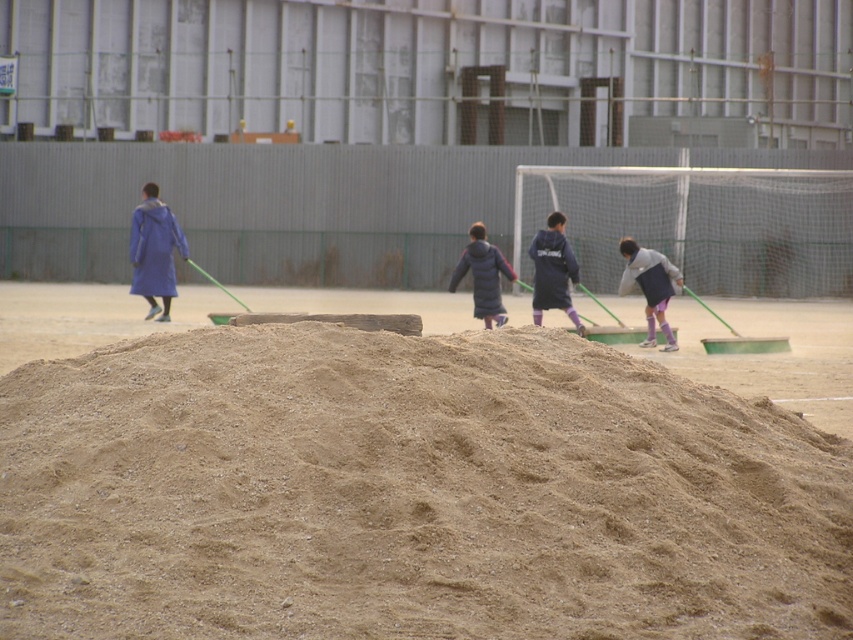
You are a worker in the sports field and need to choose a jacket to wear for the day. Based on the scene description, which jacket would be more comfortable for carrying heavy tools, the light gray fabric jacket at right or the dark blue fleece jacket at center?

The dark blue fleece jacket at center is wider than the light gray fabric jacket at right, so it would provide more comfort when carrying heavy tools.

You are a maintenance worker standing at the sand mound in the foreground. You need to hand a tool to the person wearing the light gray fabric jacket at right and the dark blue puffy jacket at center. Which person is closer to you?

The dark blue puffy jacket at center is closer to you since it is only 2.82 meters away from the light gray fabric jacket at right, but the question is about distance from your current position at the sand mound. Wait, the description says the light gray jacket is 2.82 meters from the dark blue one. If you are at the sand mound, which is in the foreground, and the people are in the midground, their positions relative to the sand mound need to be inferred. Hmm, perhaps the sand mound is in the foreground, so

You are a spectator at the sports field and want to locate the light gray fabric jacket at right and the dark blue fleece jacket at center. Based on the scene description, which jacket is positioned farther to the right?

The light gray fabric jacket at right is positioned farther to the right than the dark blue fleece jacket at center.